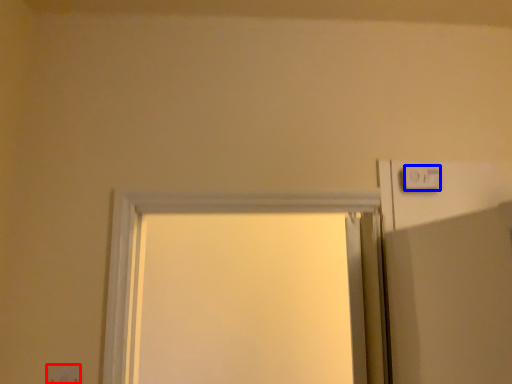
Question: Which of the following is the farthest to the observer, electric outlet (highlighted by a red box) or light switch (highlighted by a blue box)?

Choices:
 (A) electric outlet
 (B) light switch

Answer: (B)